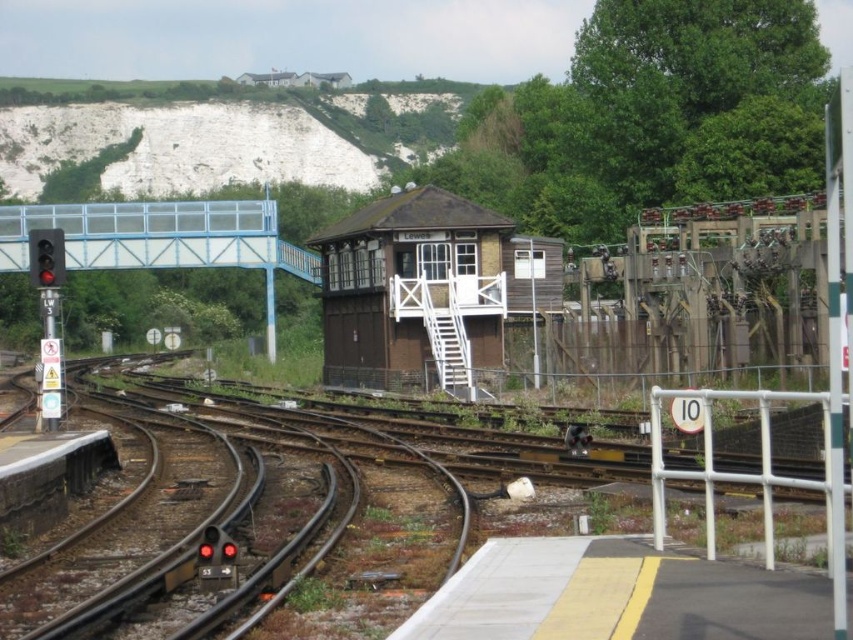
Is point (204, 625) closer to viewer compared to point (403, 380)?

That is True.

Where is `brown wooden track at center`? Image resolution: width=853 pixels, height=640 pixels. brown wooden track at center is located at coordinates (262, 506).